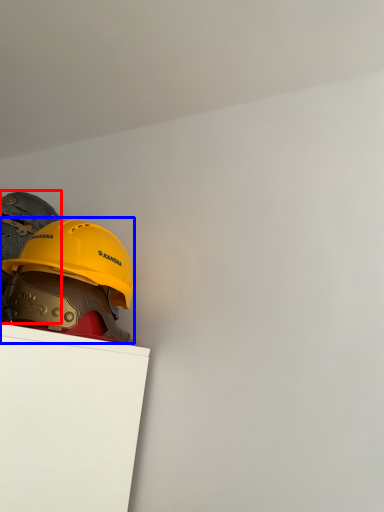
Question: Which point is closer to the camera, helmet (highlighted by a red box) or helmet (highlighted by a blue box)?

Choices:
 (A) helmet
 (B) helmet

Answer: (A)